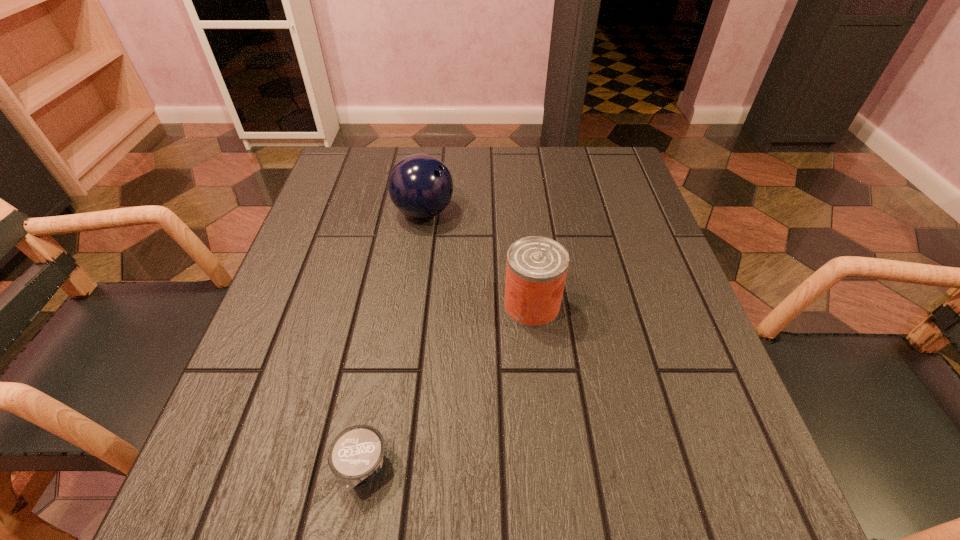
You are a GUI agent. You are given a task and a screenshot of the screen. Output one action in this format:
    pyautogui.click(x=<x>, y=<y>)
    Task: Click on the vacant region at the far edge of the desktop
    This screenshot has height=540, width=960.
    Given the screenshot: What is the action you would take?
    pyautogui.click(x=507, y=188)

The width and height of the screenshot is (960, 540). In the image, there is a desktop. Identify the location of vacant space at the near edge. (330, 501).

You are a GUI agent. You are given a task and a screenshot of the screen. Output one action in this format:
    pyautogui.click(x=<x>, y=<y>)
    Task: Click on the free space at the left edge of the desktop
    The width and height of the screenshot is (960, 540).
    Given the screenshot: What is the action you would take?
    pyautogui.click(x=268, y=323)

Where is `vacant space at the right edge of the desktop`? The image size is (960, 540). vacant space at the right edge of the desktop is located at coordinates point(624,200).

Identify the location of free spot at the near left corner of the desktop. Image resolution: width=960 pixels, height=540 pixels. (288, 471).

Where is `vacant space at the far right corner`? This screenshot has width=960, height=540. vacant space at the far right corner is located at coordinates (616, 148).

The image size is (960, 540). What are the coordinates of `vacant space at the near right corner of the desktop` in the screenshot? It's located at (739, 515).

Image resolution: width=960 pixels, height=540 pixels. I want to click on vacant area that lies between the second nearest object and the shortest object, so click(x=446, y=387).

Locate an element on the screen. The height and width of the screenshot is (540, 960). free space between the nearest object and the can is located at coordinates (446, 387).

This screenshot has width=960, height=540. I want to click on vacant region between the bowling ball and the rightmost object, so click(x=478, y=259).